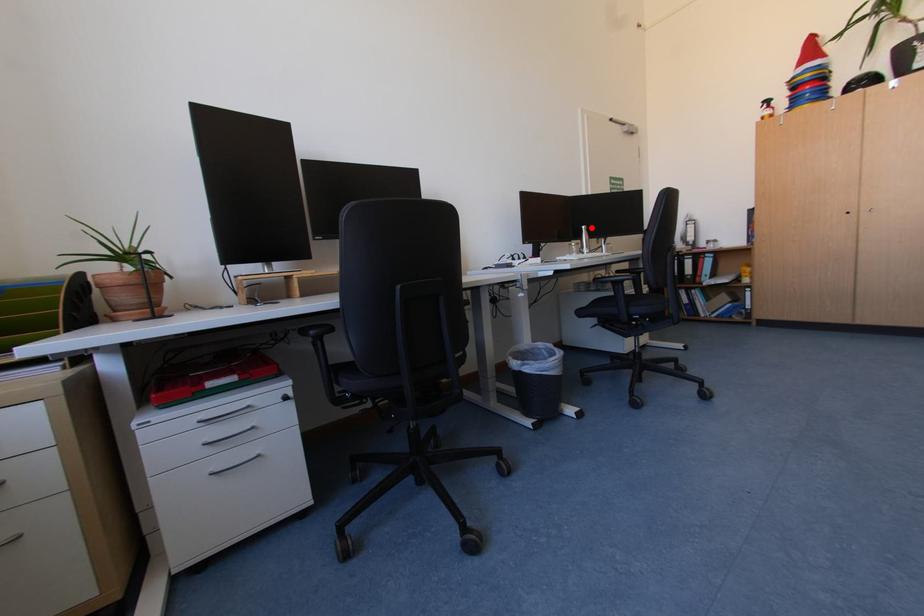
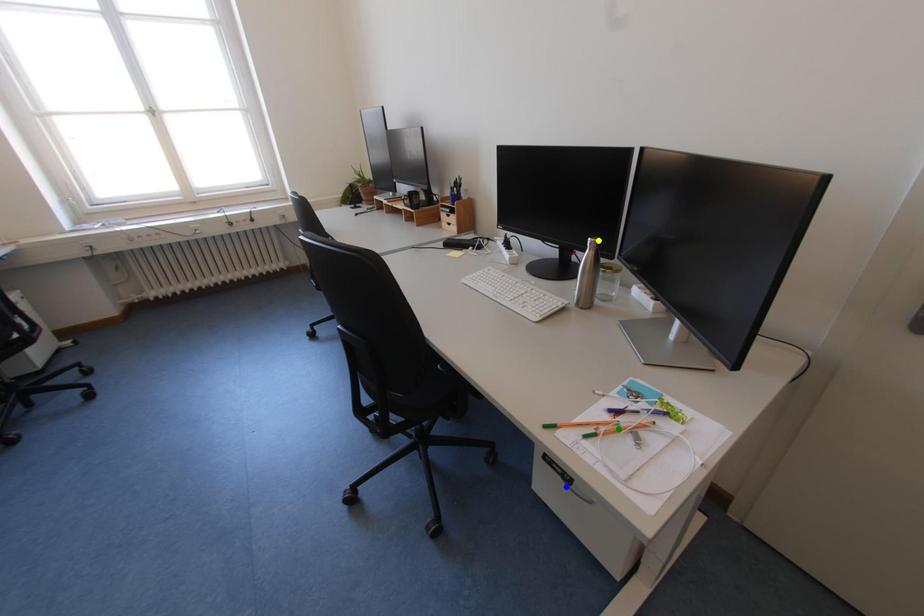
Question: I am providing you with two images of the same scene from different viewpoints. A red point is marked on the first image. You are given multiple points on the second image. Can you choose the point in image 2 that corresponds to the point in image 1?

Choices:
 (A) yellow point
 (B) green point
 (C) blue point

Answer: (A)